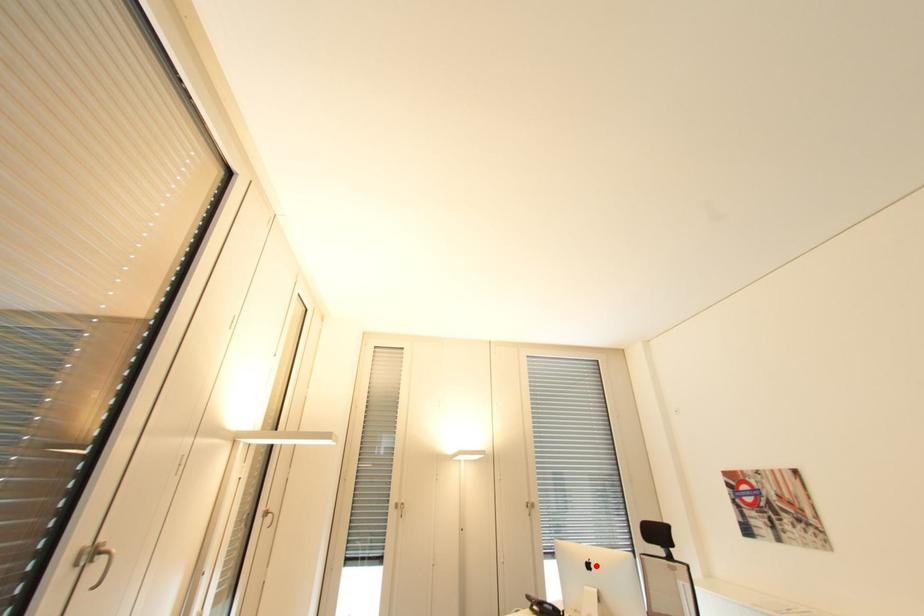
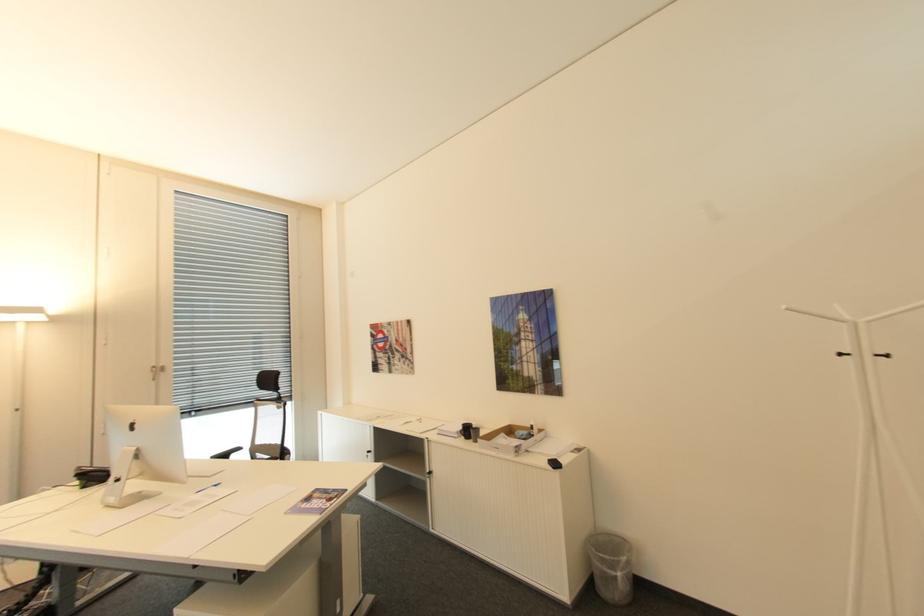
In the second image, find the point that corresponds to the highlighted location in the first image.

(140, 426)